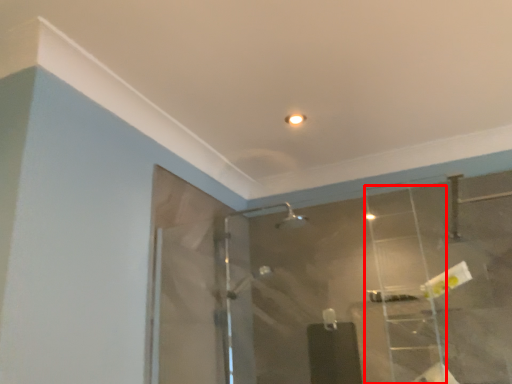
Question: From the image's perspective, what is the correct spatial positioning of ladder (annotated by the red box) in reference to mirror?

Choices:
 (A) below
 (B) above

Answer: (B)